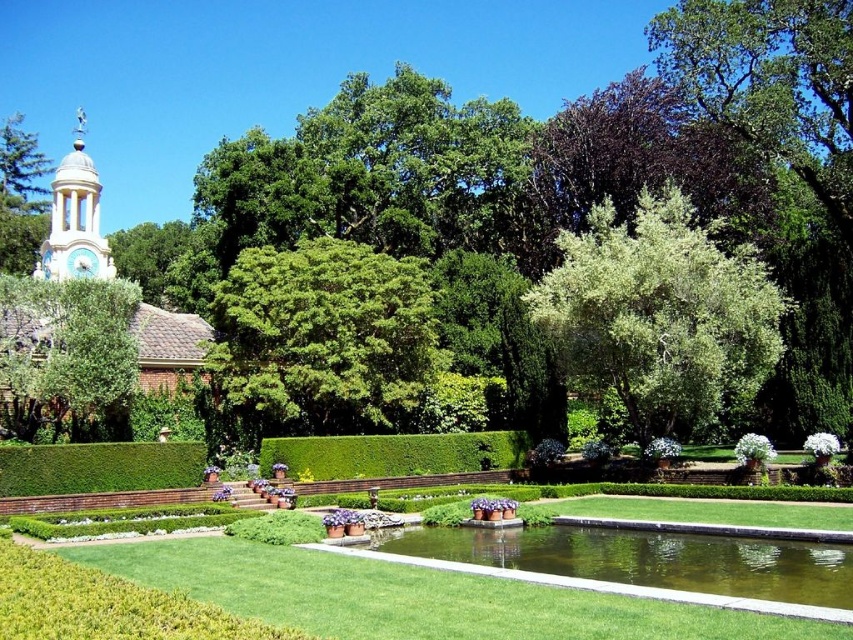
You are a gardener planning to install a new decorative statue that requires a base height of 1 meter. You have two options for placement in the garden scene described. The first option is on the green concrete pond at center, and the second is on the green leafy hedge at center. Which location would provide sufficient height for the statue base?

The green leafy hedge at center is taller than the green concrete pond at center. Therefore, placing the statue on the green leafy hedge at center would provide the necessary height of 1 meter for the statue base.

Consider the image. You are standing in the garden and want to reach the point marked at coordinates point (753, 614). If your walking speed is 1.5 meters per second, how many seconds will it take you to reach that point?

The distance between you and the point (753, 614) is 29.30 meters. At a walking speed of 1.5 meters per second, it will take approximately 19.53 seconds to reach the point.